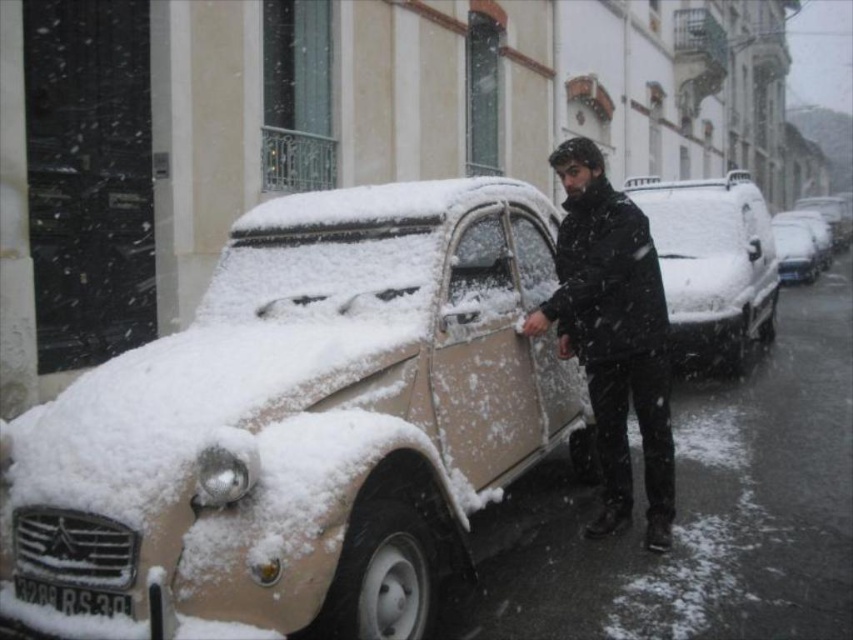
Question: Can you confirm if black matte jacket at center is wider than white plastic license plate at lower center?

Choices:
 (A) yes
 (B) no

Answer: (A)

Question: Which of the following is the farthest from the observer?

Choices:
 (A) (407, 442)
 (B) (666, 273)
 (C) (598, 445)

Answer: (B)

Question: Which point appears closest to the camera in this image?

Choices:
 (A) (630, 192)
 (B) (317, 632)
 (C) (581, 157)

Answer: (B)

Question: Can you confirm if black matte jacket at center is positioned to the right of snow-covered beige car at center?

Choices:
 (A) no
 (B) yes

Answer: (A)

Question: Based on their relative distances, which object is nearer to the white plastic license plate at lower center?

Choices:
 (A) beige matte car at center
 (B) snow-covered beige car at center

Answer: (A)

Question: Does beige matte car at center appear over black matte jacket at center?

Choices:
 (A) yes
 (B) no

Answer: (B)